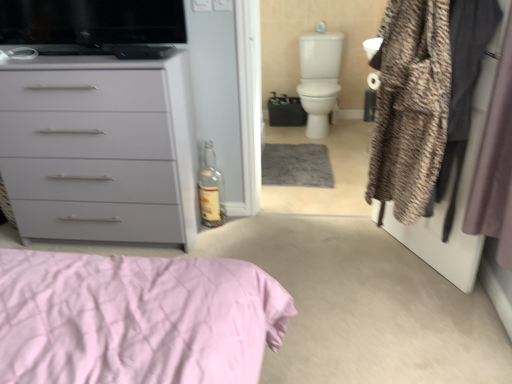
Question: From a real-world perspective, is textured brown coat at right over white glossy toilet bowl at upper right?

Choices:
 (A) no
 (B) yes

Answer: (B)

Question: From the image's perspective, is textured brown coat at right under white glossy toilet bowl at upper right?

Choices:
 (A) no
 (B) yes

Answer: (B)

Question: Is textured brown coat at right positioned with its back to white glossy toilet bowl at upper right?

Choices:
 (A) no
 (B) yes

Answer: (A)

Question: From a real-world perspective, is textured brown coat at right beneath white glossy toilet bowl at upper right?

Choices:
 (A) no
 (B) yes

Answer: (A)

Question: Is textured brown coat at right taller than white glossy toilet bowl at upper right?

Choices:
 (A) yes
 (B) no

Answer: (A)

Question: Is matte gray chest of drawers at left wider or thinner than textured brown coat at right?

Choices:
 (A) wide
 (B) thin

Answer: (A)

Question: In terms of size, does matte gray chest of drawers at left appear bigger or smaller than textured brown coat at right?

Choices:
 (A) big
 (B) small

Answer: (A)

Question: From their relative heights in the image, would you say matte gray chest of drawers at left is taller or shorter than textured brown coat at right?

Choices:
 (A) short
 (B) tall

Answer: (B)

Question: Is matte gray chest of drawers at left spatially inside textured brown coat at right, or outside of it?

Choices:
 (A) inside
 (B) outside

Answer: (B)

Question: Does point (485, 233) appear closer or farther from the camera than point (209, 142)?

Choices:
 (A) closer
 (B) farther

Answer: (A)

Question: Looking at the image, does silky purple curtain at right seem bigger or smaller compared to transparent glass bottle at center?

Choices:
 (A) big
 (B) small

Answer: (A)

Question: Considering the relative positions of silky purple curtain at right and transparent glass bottle at center in the image provided, is silky purple curtain at right to the left or to the right of transparent glass bottle at center?

Choices:
 (A) right
 (B) left

Answer: (A)

Question: From their relative heights in the image, would you say silky purple curtain at right is taller or shorter than transparent glass bottle at center?

Choices:
 (A) tall
 (B) short

Answer: (A)

Question: Considering their positions, is textured brown coat at right located in front of or behind white glossy toilet bowl at upper right?

Choices:
 (A) front
 (B) behind

Answer: (A)

Question: Is textured brown coat at right inside or outside of white glossy toilet bowl at upper right?

Choices:
 (A) inside
 (B) outside

Answer: (B)